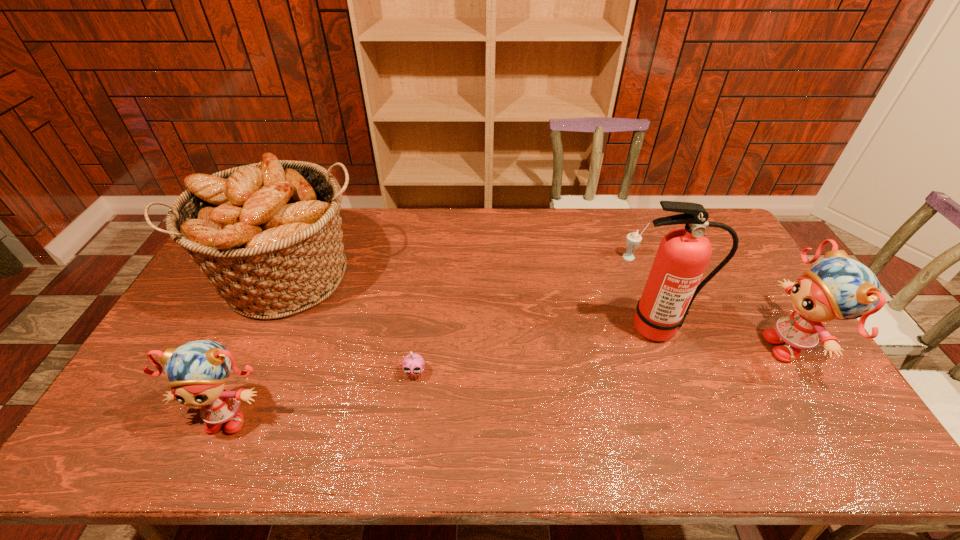
Identify the location of object at the far left corner. (268, 235).

At what (x,y) coordinates should I click in order to perform the action: click on object that is at the near left corner. Please return your answer as a coordinate pair (x, y). Image resolution: width=960 pixels, height=540 pixels. Looking at the image, I should click on (197, 371).

You are a GUI agent. You are given a task and a screenshot of the screen. Output one action in this format:
    pyautogui.click(x=<x>, y=<y>)
    Task: Click on the object present at the near right corner
    
    Given the screenshot: What is the action you would take?
    pyautogui.click(x=837, y=287)

Image resolution: width=960 pixels, height=540 pixels. I want to click on free spot at the far edge of the desktop, so click(380, 235).

This screenshot has height=540, width=960. I want to click on vacant space at the near edge, so click(665, 411).

Where is `vacant area at the right edge`? Image resolution: width=960 pixels, height=540 pixels. vacant area at the right edge is located at coordinates (737, 335).

Where is `free space at the near right corner`? The image size is (960, 540). free space at the near right corner is located at coordinates (806, 394).

The height and width of the screenshot is (540, 960). I want to click on empty location between the third shortest object and the fifth shortest object, so click(261, 345).

Locate an element on the screen. The height and width of the screenshot is (540, 960). free spot between the fifth tallest object and the third object from left to right is located at coordinates (523, 315).

Locate an element on the screen. This screenshot has height=540, width=960. vacant space in between the shortest object and the tallest object is located at coordinates (x=537, y=350).